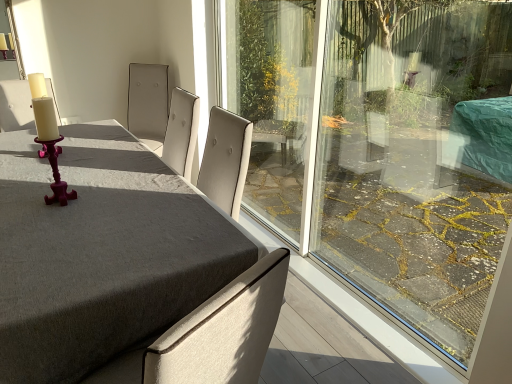
Question: From a real-world perspective, is matte white chair at left positioned above or below matte purple candlestick at left?

Choices:
 (A) above
 (B) below

Answer: (B)

Question: Choose the correct answer: Is matte white chair at left inside matte purple candlestick at left or outside it?

Choices:
 (A) outside
 (B) inside

Answer: (A)

Question: Estimate the real-world distances between objects in this image. Which object is farther from the matte gray table at center?

Choices:
 (A) matte white chair at left
 (B) matte purple candlestick at left

Answer: (A)

Question: Which object is the closest to the matte purple candlestick at left?

Choices:
 (A) matte white chair at left
 (B) matte gray table at center

Answer: (B)